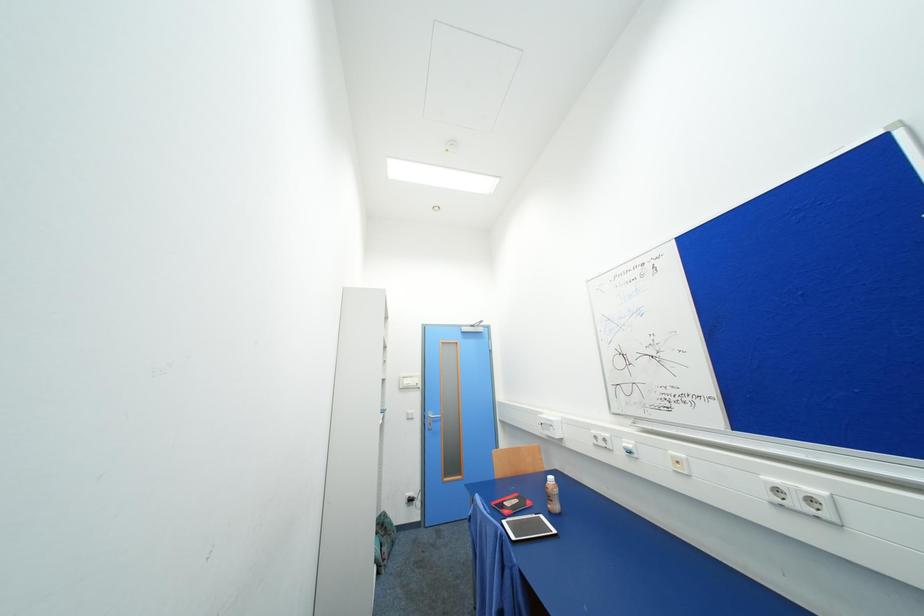
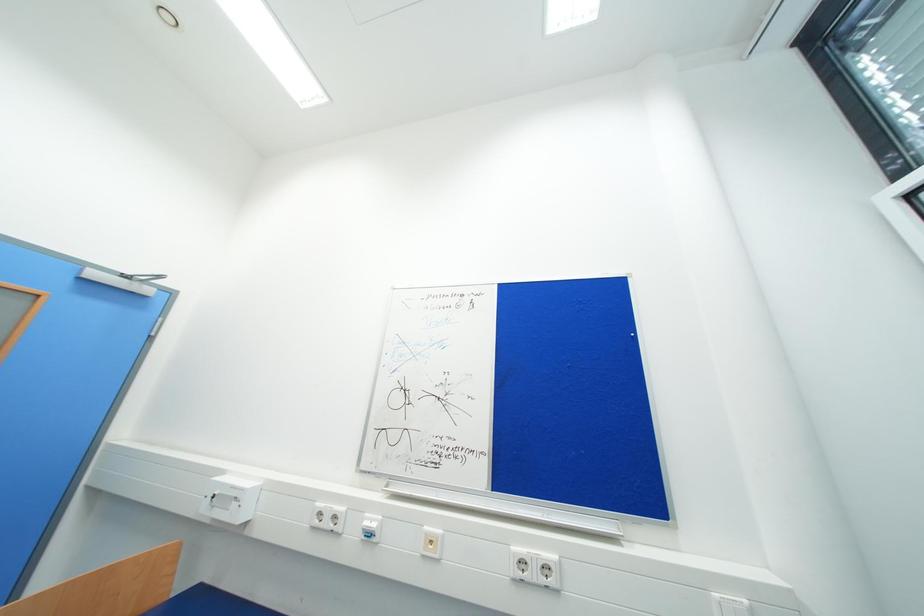
Question: Based on the continuous images, in which direction is the camera rotating? Reply with the corresponding letter.

Choices:
 (A) Left
 (B) Right
 (C) Up
 (D) Down

Answer: (B)